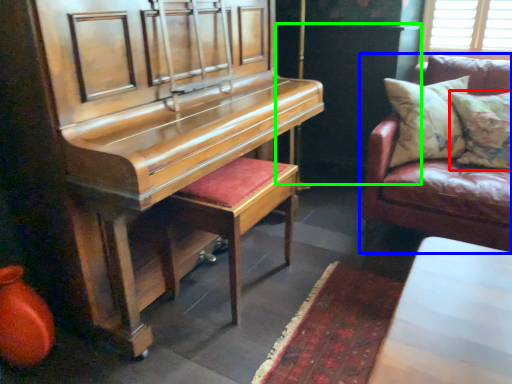
Question: Which object is positioned farthest from pillow (highlighted by a red box)? Select from studio couch (highlighted by a blue box) and dark (highlighted by a green box).

Choices:
 (A) studio couch
 (B) dark

Answer: (B)